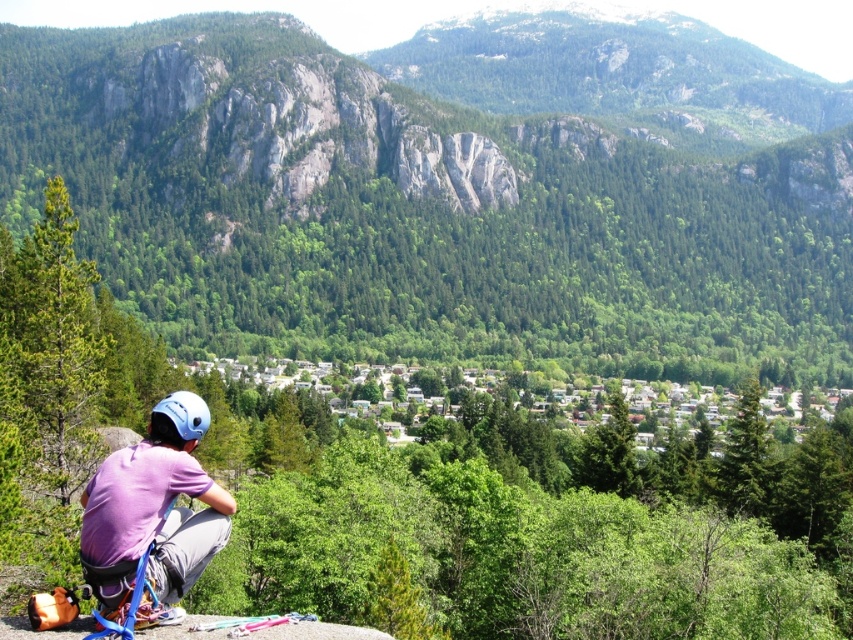
You are a photographer standing at the edge of the valley looking towards the town. You notice two points in the scene labeled as point [572,307] and point [186,424]. Which point is closer to your camera?

Point [186,424] is closer to the camera because it is positioned behind point [572,307], which is further away from the camera.

You are a hiker planning to cross a narrow path between the rocky cliff at center and the purple fabric helmet at lower left. The path is only 1 meter wide. Can your 0.8 meter wide backpack fit through the path?

The rocky cliff at center might be wider than purple fabric helmet at lower left, but since the path is 1 meter wide and your backpack is 0.8 meters wide, it should fit as long as the path width isn not obstructed by other objects.

You are a hiker who just arrived at the climbing site and see the purple fabric helmet at lower left and the blue matte helmet at lower left. Which helmet is positioned closer to you?

The purple fabric helmet at lower left is closer to the viewer than the blue matte helmet at lower left.